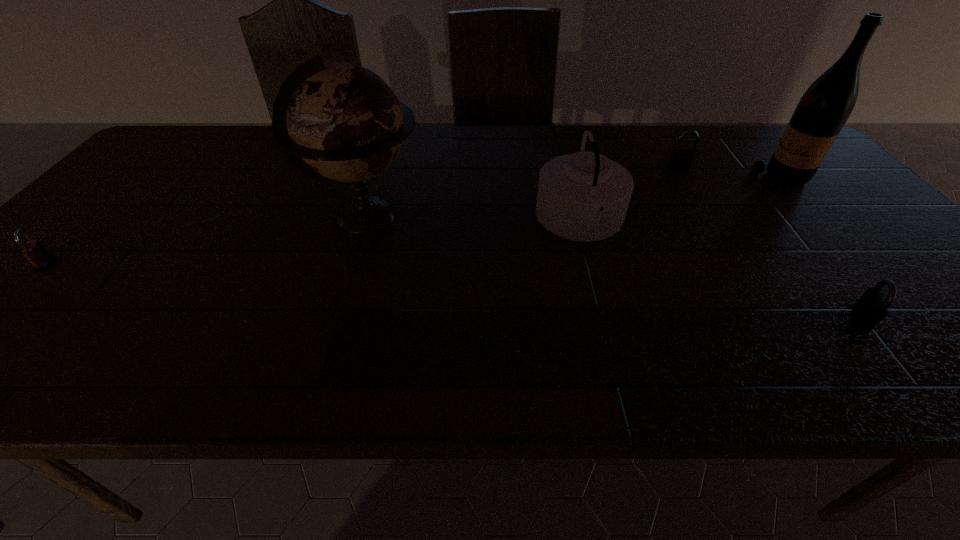
This screenshot has width=960, height=540. Find the location of `free point located on the front of the wine bottle`. free point located on the front of the wine bottle is located at coordinates (826, 230).

Where is `free space located on the front of the second object from left to right showing Asia`? free space located on the front of the second object from left to right showing Asia is located at coordinates (571, 218).

Find the location of a particular element. The image size is (960, 540). vacant space positioned on the spout of the kettle is located at coordinates (492, 221).

This screenshot has width=960, height=540. Find the location of `free spot located 0.200m on the spout of the kettle`. free spot located 0.200m on the spout of the kettle is located at coordinates (456, 221).

Where is `vacant space positioned on the spout of the kettle`? The image size is (960, 540). vacant space positioned on the spout of the kettle is located at coordinates (396, 221).

Image resolution: width=960 pixels, height=540 pixels. I want to click on vacant space located 0.190m on the front-facing side of the second padlock from right to left, so click(704, 210).

At what (x,y) coordinates should I click in order to perform the action: click on free region located 0.310m on the left of the rightmost padlock. Please return your answer as a coordinate pair (x, y). The width and height of the screenshot is (960, 540). Looking at the image, I should click on (x=697, y=319).

Find the location of a particular element. Image resolution: width=960 pixels, height=540 pixels. free region located on the back of the leftmost object is located at coordinates (115, 195).

Locate an element on the screen. The height and width of the screenshot is (540, 960). object situated at the left edge is located at coordinates (33, 250).

Locate an element on the screen. The width and height of the screenshot is (960, 540). object that is at the right edge is located at coordinates (823, 110).